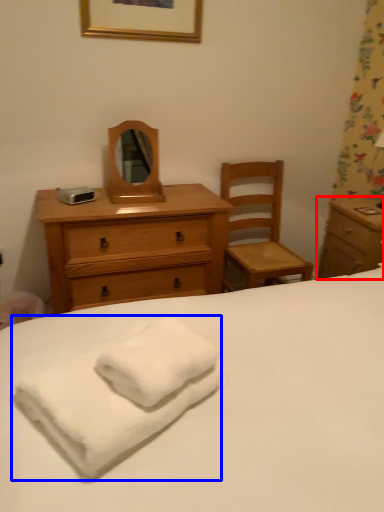
Question: Which of the following is the closest to the observer, nightstand (highlighted by a red box) or bath towel (highlighted by a blue box)?

Choices:
 (A) nightstand
 (B) bath towel

Answer: (B)